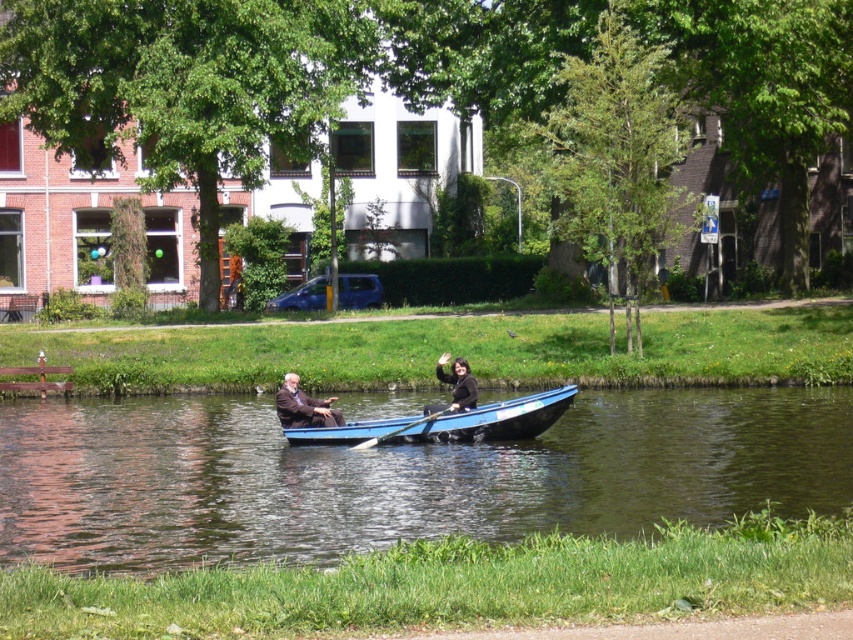
You are a GUI agent. You are given a task and a screenshot of the screen. Output one action in this format:
    pyautogui.click(x=<x>, y=<y>)
    Task: Click on the blue smooth water at center
    
    Given the screenshot: What is the action you would take?
    pyautogui.click(x=396, y=476)

Does point (312, 408) lie in front of point (456, 381)?

Yes, point (312, 408) is in front of point (456, 381).

Between dark brown leather jacket at center and black fabric jacket at center, which one appears on the right side from the viewer's perspective?

black fabric jacket at center

The image size is (853, 640). In order to click on dark brown leather jacket at center in this screenshot , I will do `click(303, 406)`.

Looking at this image, does blue smooth water at center have a greater width compared to dark brown leather jacket at center?

Indeed, blue smooth water at center has a greater width compared to dark brown leather jacket at center.

Can you confirm if blue smooth water at center is positioned to the right of dark brown leather jacket at center?

Correct, you'll find blue smooth water at center to the right of dark brown leather jacket at center.

Describe the element at coordinates (396, 476) in the screenshot. I see `blue smooth water at center` at that location.

Locate an element on the screen. The image size is (853, 640). blue smooth water at center is located at coordinates (396, 476).